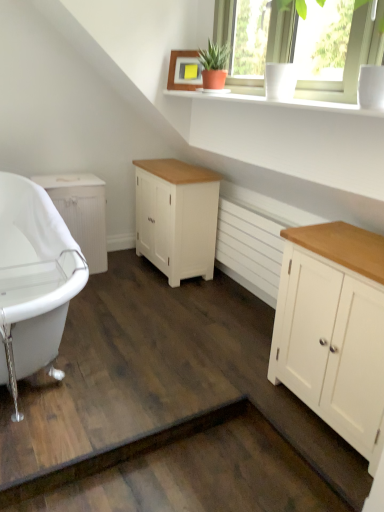
Question: Does white painted wood cabinet at right, which appears as the 1th cabinetry when viewed from the right, come behind white glossy cup at upper right?

Choices:
 (A) yes
 (B) no

Answer: (B)

Question: Can you confirm if white painted wood cabinet at right, which is the third cabinetry in back-to-front order, is positioned to the left of white glossy cup at upper right?

Choices:
 (A) no
 (B) yes

Answer: (A)

Question: Is white painted wood cabinet at right, which is the third cabinetry in back-to-front order, positioned with its back to white glossy cup at upper right?

Choices:
 (A) yes
 (B) no

Answer: (B)

Question: Is white painted wood cabinet at right, the 3th cabinetry viewed from the left, in front of white glossy cup at upper right?

Choices:
 (A) no
 (B) yes

Answer: (B)

Question: From a real-world perspective, is white painted wood cabinet at right, which is the third cabinetry in back-to-front order, physically below white glossy cup at upper right?

Choices:
 (A) yes
 (B) no

Answer: (A)

Question: From the image's perspective, is white glossy bathtub at lower left located above or below white matte radiator at center?

Choices:
 (A) below
 (B) above

Answer: (A)

Question: Is white glossy bathtub at lower left spatially inside white matte radiator at center, or outside of it?

Choices:
 (A) outside
 (B) inside

Answer: (A)

Question: Is white glossy bathtub at lower left to the left or to the right of white matte radiator at center in the image?

Choices:
 (A) left
 (B) right

Answer: (A)

Question: Is point (16, 184) closer or farther from the camera than point (236, 237)?

Choices:
 (A) closer
 (B) farther

Answer: (A)

Question: Considering the positions of point (162, 242) and point (3, 281), is point (162, 242) closer or farther from the camera than point (3, 281)?

Choices:
 (A) farther
 (B) closer

Answer: (A)

Question: Considering the positions of white painted wood cabinet at center, the 2th cabinetry in the front-to-back sequence, and white glossy bathtub at lower left in the image, is white painted wood cabinet at center, the 2th cabinetry in the front-to-back sequence, bigger or smaller than white glossy bathtub at lower left?

Choices:
 (A) big
 (B) small

Answer: (B)

Question: Considering their positions, is white painted wood cabinet at center, placed as the second cabinetry when sorted from back to front, located in front of or behind white glossy bathtub at lower left?

Choices:
 (A) front
 (B) behind

Answer: (B)

Question: In the image, is white painted wood cabinet at center, placed as the second cabinetry when sorted from back to front, on the left side or the right side of white glossy bathtub at lower left?

Choices:
 (A) right
 (B) left

Answer: (A)

Question: From a real-world perspective, is wooden picture frame at upper center above or below white painted wood cabinet at right, which is the third cabinetry in back-to-front order?

Choices:
 (A) above
 (B) below

Answer: (A)

Question: Based on their positions, is wooden picture frame at upper center located to the left or right of white painted wood cabinet at right, which is the third cabinetry in back-to-front order?

Choices:
 (A) right
 (B) left

Answer: (B)